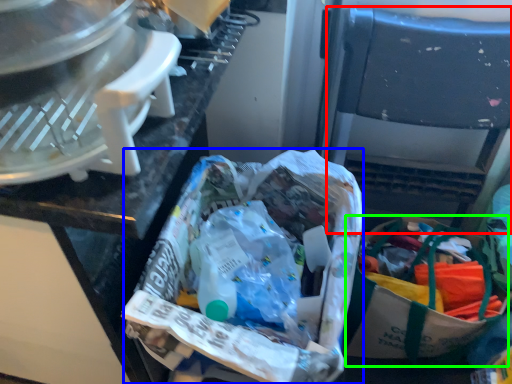
Question: Which is nearer to the folding chair (highlighted by a red box)? material (highlighted by a blue box) or shopping bag (highlighted by a green box).

Choices:
 (A) material
 (B) shopping bag

Answer: (B)